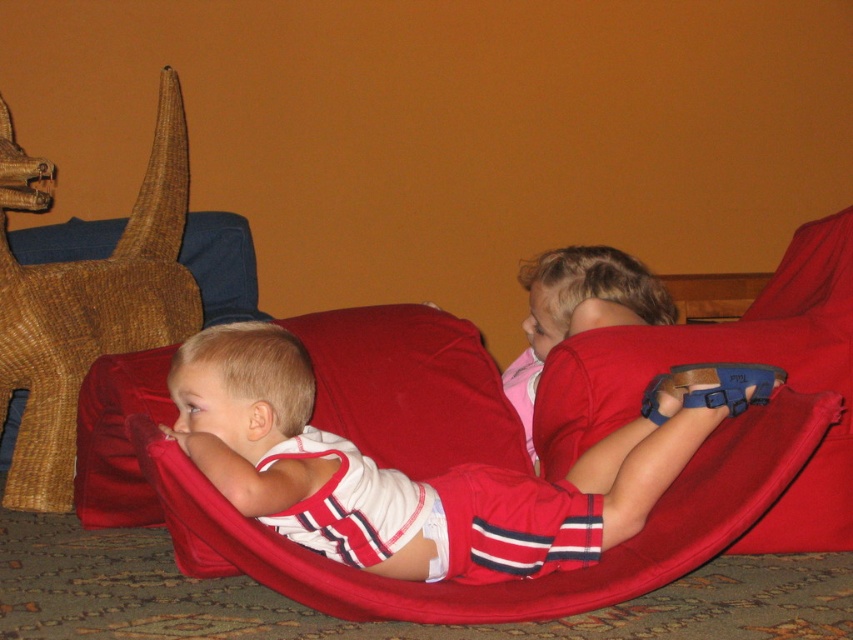
You are a parent trying to retrieve the woven wicker toy at left for your child. The red fabric bean bag at center is in the way. Can you easily reach the toy without moving the bean bag?

The woven wicker toy at left is located above the red fabric bean bag at center, so you can easily reach it without moving the bean bag since it is positioned higher up.

Looking at this image, you are a parent trying to organize the living room. You want to place the white striped fabric at center and the woven wicker toy at left closer together so they are only 1 meter apart. Is this possible without moving the red beanbag chair?

The current distance between the white striped fabric at center and the woven wicker toy at left is 1.22 meters. To reduce the distance to 1 meter, you would need to move them closer by 0.22 meters. Since the red beanbag chair is in the way, it might block the space needed to adjust their positions. Without moving the beanbag, it might not be possible to achieve the desired 1 meter distance between them.